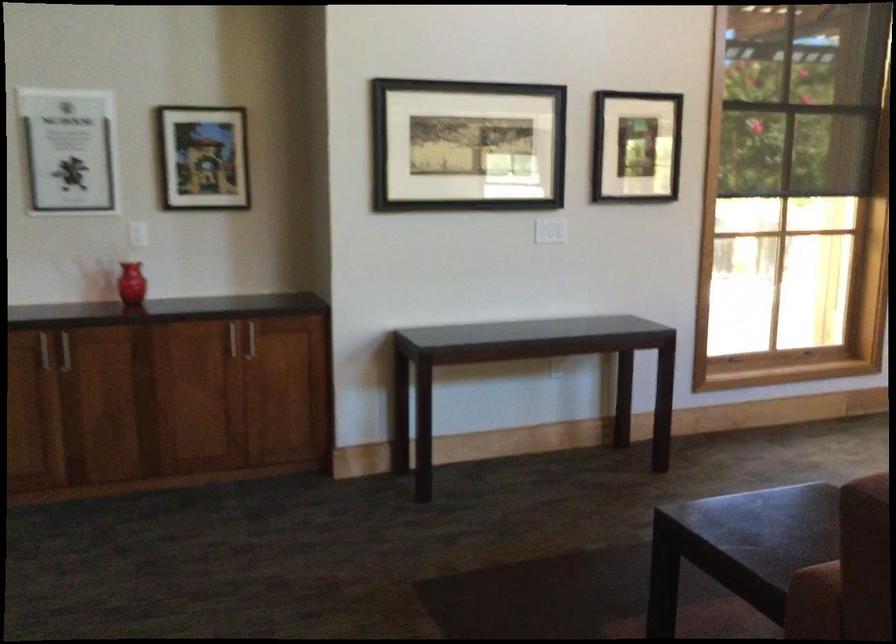
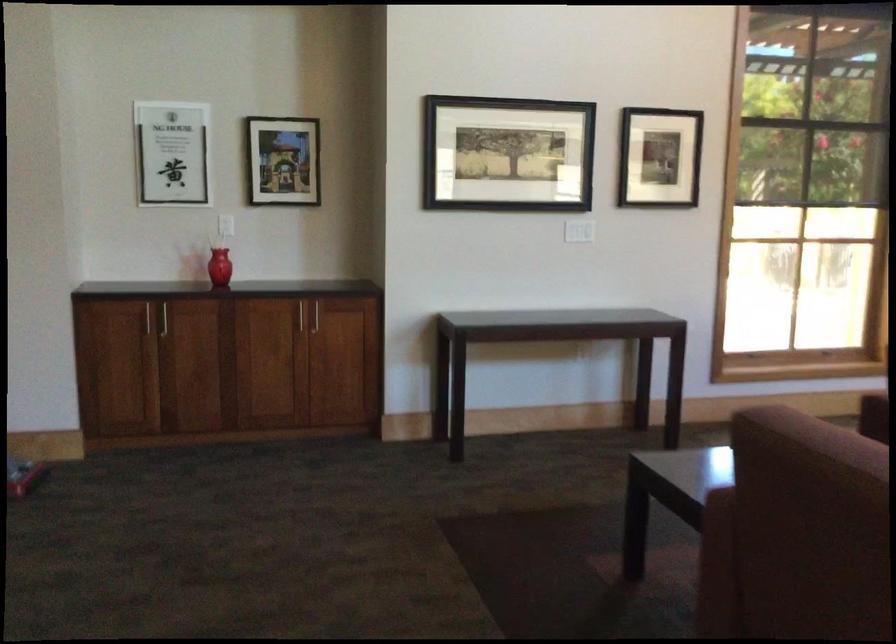
Question: The images are taken continuously from a first-person perspective. In which direction is your viewpoint rotating?

Choices:
 (A) Left
 (B) Right
 (C) Up
 (D) Down

Answer: (A)